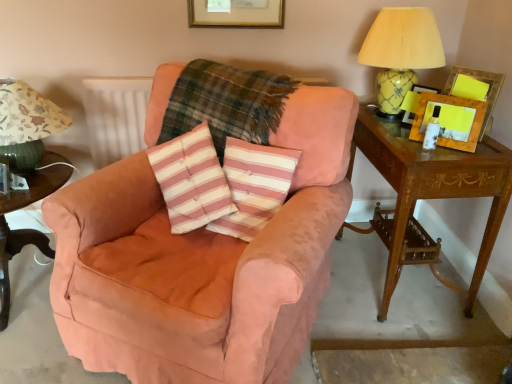
Where is `vacant space underneath mahogany wood side table at right (from a real-world perspective)`? The image size is (512, 384). vacant space underneath mahogany wood side table at right (from a real-world perspective) is located at coordinates (x=401, y=274).